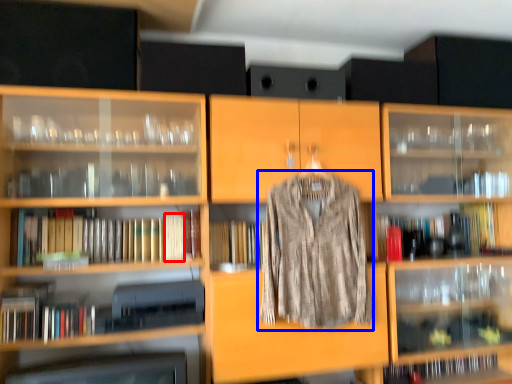
Question: Among these objects, which one is farthest to the camera, book (highlighted by a red box) or clothing (highlighted by a blue box)?

Choices:
 (A) book
 (B) clothing

Answer: (A)